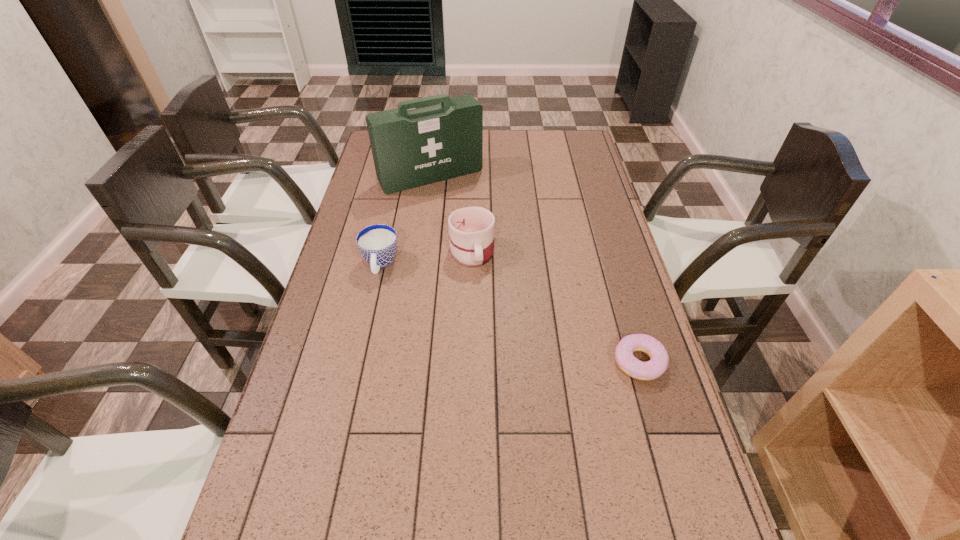
At what (x,y) coordinates should I click in order to perform the action: click on free space on the desktop that is between the second shortest object and the doughnut and is positioned on the front-facing side of the tallest object. Please return your answer as a coordinate pair (x, y). Looking at the image, I should click on (526, 320).

At what (x,y) coordinates should I click in order to perform the action: click on vacant space on the desktop that is between the third tallest object and the shortest object and is positioned on the side with the handle of the third shortest object. Please return your answer as a coordinate pair (x, y). This screenshot has width=960, height=540. Looking at the image, I should click on (480, 302).